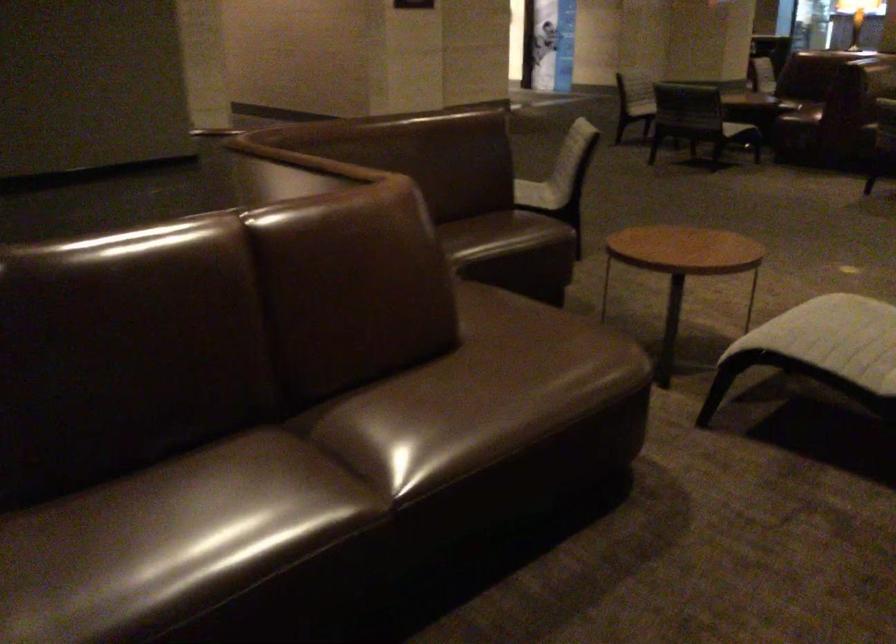
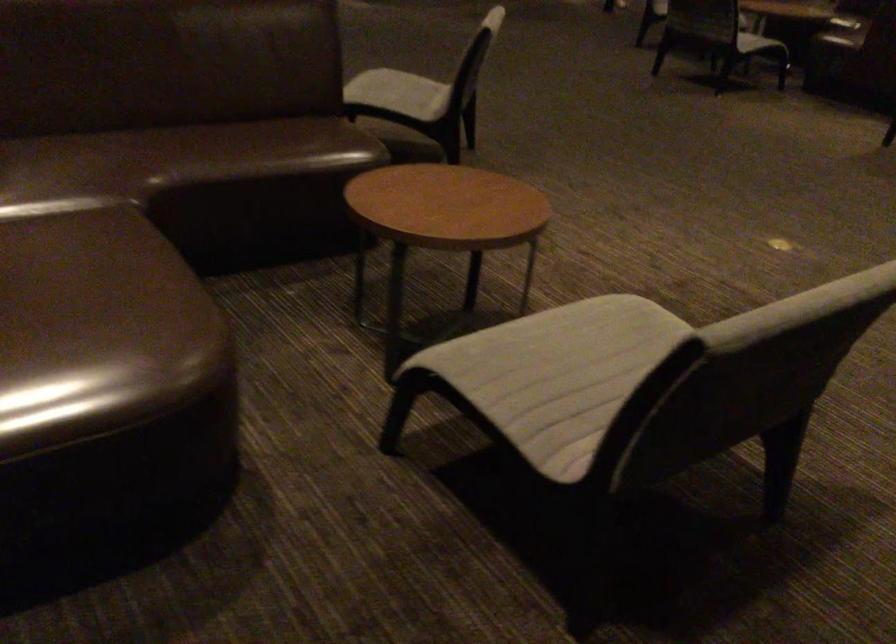
Which direction would the cameraman need to move to produce the second image?

The movement direction of the cameraman is right, forward.